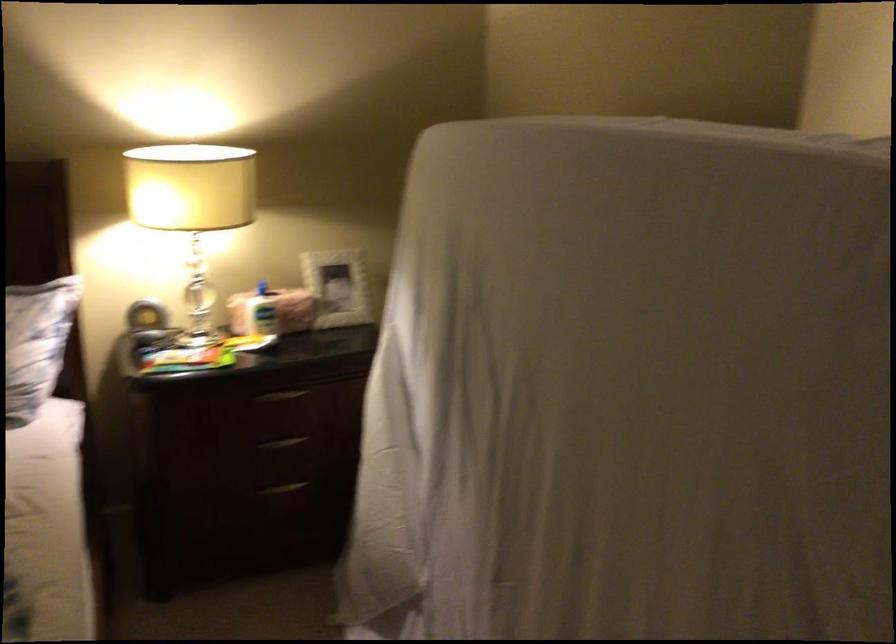
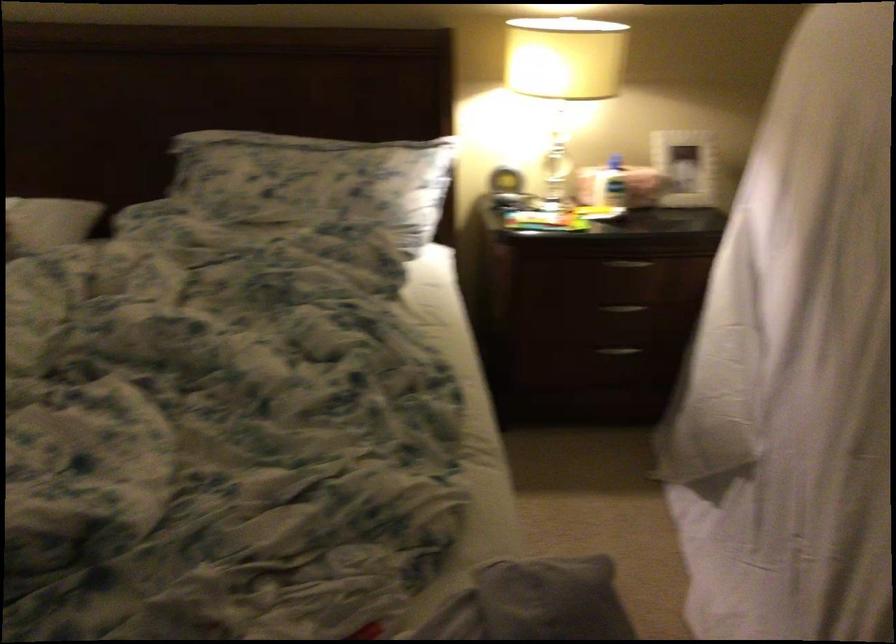
The images are taken continuously from a first-person perspective. In which direction are you moving?

The cameraman moved toward left, backward.